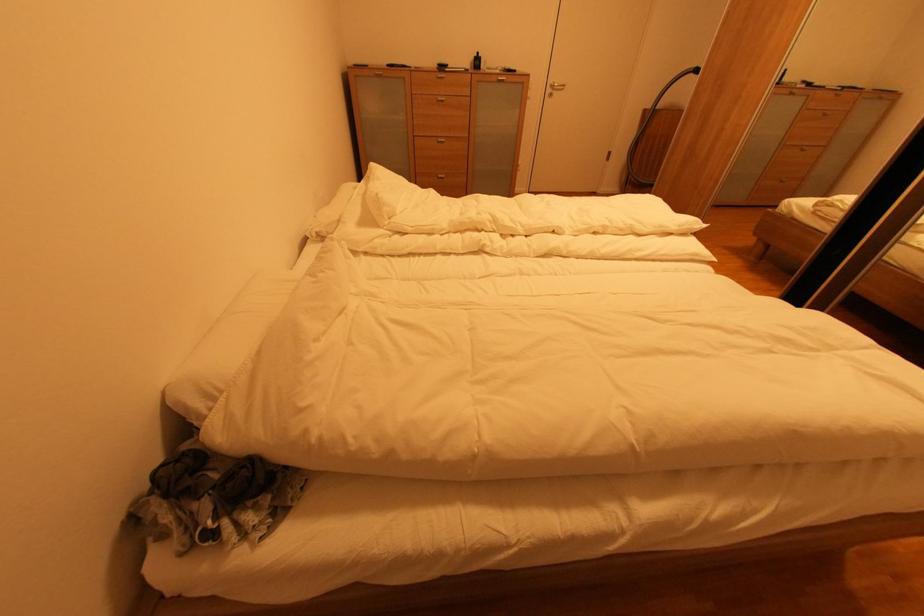
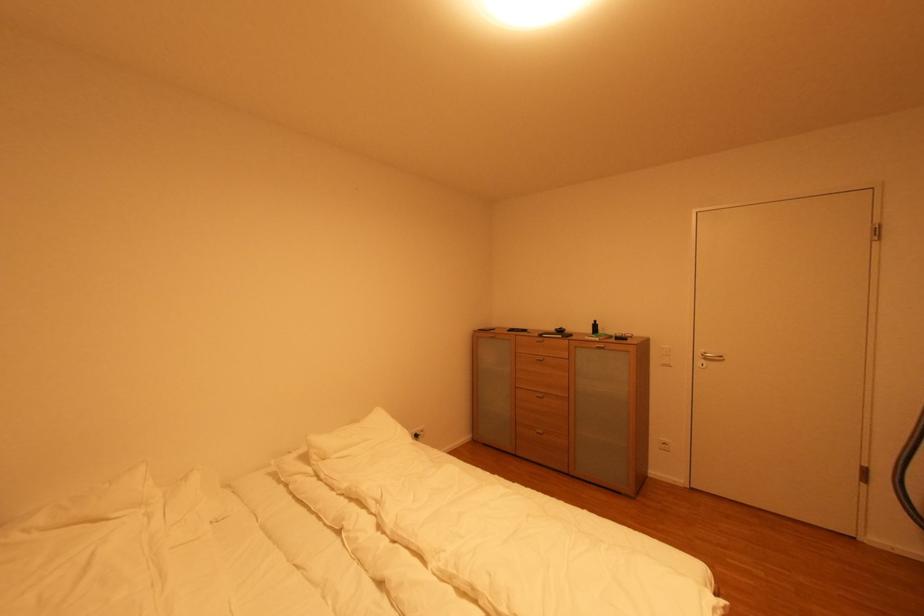
In the second image, find the point that corresponds to point 417,71 in the first image.

(521, 336)